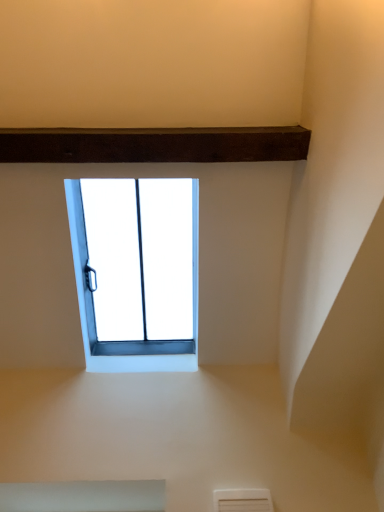
Where is `white plastic air conditioning at lower center`? white plastic air conditioning at lower center is located at coordinates (242, 500).

What do you see at coordinates (242, 500) in the screenshot? I see `white plastic air conditioning at lower center` at bounding box center [242, 500].

This screenshot has width=384, height=512. What do you see at coordinates (86, 314) in the screenshot?
I see `white plastic window at center` at bounding box center [86, 314].

Find the location of a particular element. white plastic window at center is located at coordinates (86, 314).

Identify the location of white plastic air conditioning at lower center. The height and width of the screenshot is (512, 384). (242, 500).

Looking at this image, is white plastic air conditioning at lower center at the right side of white plastic window at center?

Yes.

Considering the relative positions of white plastic air conditioning at lower center and white plastic window at center in the image provided, is white plastic air conditioning at lower center in front of white plastic window at center?

That is False.

Which is behind, point (217, 509) or point (89, 347)?

The point (89, 347) is farther.

Looking at this image, from the image's perspective, which one is positioned higher, white plastic air conditioning at lower center or white plastic window at center?

white plastic window at center is shown above in the image.

From a real-world perspective, does white plastic air conditioning at lower center sit lower than white plastic window at center?

Yes, from a real-world perspective, white plastic air conditioning at lower center is below white plastic window at center.

Which object is thinner, white plastic air conditioning at lower center or white plastic window at center?

Thinner between the two is white plastic air conditioning at lower center.

Considering the relative sizes of white plastic air conditioning at lower center and white plastic window at center in the image provided, is white plastic air conditioning at lower center shorter than white plastic window at center?

Yes, white plastic air conditioning at lower center is shorter than white plastic window at center.

Is white plastic air conditioning at lower center bigger than white plastic window at center?

No.

Which is correct: white plastic air conditioning at lower center is inside white plastic window at center, or outside of it?

The correct answer is: outside.

Is white plastic air conditioning at lower center next to white plastic window at center?

white plastic air conditioning at lower center is not next to white plastic window at center, and they're not touching.

Is white plastic air conditioning at lower center turned away from white plastic window at center?

No, white plastic air conditioning at lower center's orientation is not away from white plastic window at center.

How different are the orientations of white plastic air conditioning at lower center and white plastic window at center in degrees?

white plastic air conditioning at lower center and white plastic window at center are facing 0.799 degrees away from each other.

Based on the photo, how much distance is there between white plastic air conditioning at lower center and white plastic window at center?

white plastic air conditioning at lower center and white plastic window at center are 28.24 inches apart.

What are the coordinates of `window that appears in front of the white plastic air conditioning at lower center` in the screenshot? It's located at (86, 314).

Is white plastic window at center to the left of white plastic air conditioning at lower center from the viewer's perspective?

Yes, white plastic window at center is to the left of white plastic air conditioning at lower center.

Considering the positions of objects white plastic window at center and white plastic air conditioning at lower center in the image provided, who is behind, white plastic window at center or white plastic air conditioning at lower center?

white plastic air conditioning at lower center is behind.

Does point (88, 361) come in front of point (261, 503)?

No, (88, 361) is further to viewer.

From the image's perspective, is white plastic window at center on white plastic air conditioning at lower center?

Indeed, from the image's perspective, white plastic window at center is shown above white plastic air conditioning at lower center.

From a real-world perspective, is white plastic window at center positioned under white plastic air conditioning at lower center based on gravity?

Actually, white plastic window at center is physically above white plastic air conditioning at lower center in the real world.

Between white plastic window at center and white plastic air conditioning at lower center, which one has larger width?

white plastic window at center is wider.

Considering the sizes of objects white plastic window at center and white plastic air conditioning at lower center in the image provided, who is shorter, white plastic window at center or white plastic air conditioning at lower center?

With less height is white plastic air conditioning at lower center.

Considering the relative sizes of white plastic window at center and white plastic air conditioning at lower center in the image provided, is white plastic window at center smaller than white plastic air conditioning at lower center?

Incorrect, white plastic window at center is not smaller in size than white plastic air conditioning at lower center.

Is white plastic window at center located outside white plastic air conditioning at lower center?

Indeed, white plastic window at center is completely outside white plastic air conditioning at lower center.

In the scene shown: Is white plastic window at center next to white plastic air conditioning at lower center?

No, white plastic window at center is not next to white plastic air conditioning at lower center.

Is white plastic window at center oriented towards white plastic air conditioning at lower center?

No, white plastic window at center is not aimed at white plastic air conditioning at lower center.

How distant is white plastic window at center from white plastic air conditioning at lower center?

The distance of white plastic window at center from white plastic air conditioning at lower center is 28.24 inches.

You are a GUI agent. You are given a task and a screenshot of the screen. Output one action in this format:
    pyautogui.click(x=<x>, y=<y>)
    Task: Click on the air conditioning behind the white plastic window at center
    The image size is (384, 512).
    Given the screenshot: What is the action you would take?
    pyautogui.click(x=242, y=500)

The width and height of the screenshot is (384, 512). There is a white plastic air conditioning at lower center. Find the location of `window above it (from a real-world perspective)`. window above it (from a real-world perspective) is located at coordinates (86, 314).

Identify the location of window on the left of white plastic air conditioning at lower center. Image resolution: width=384 pixels, height=512 pixels. (86, 314).